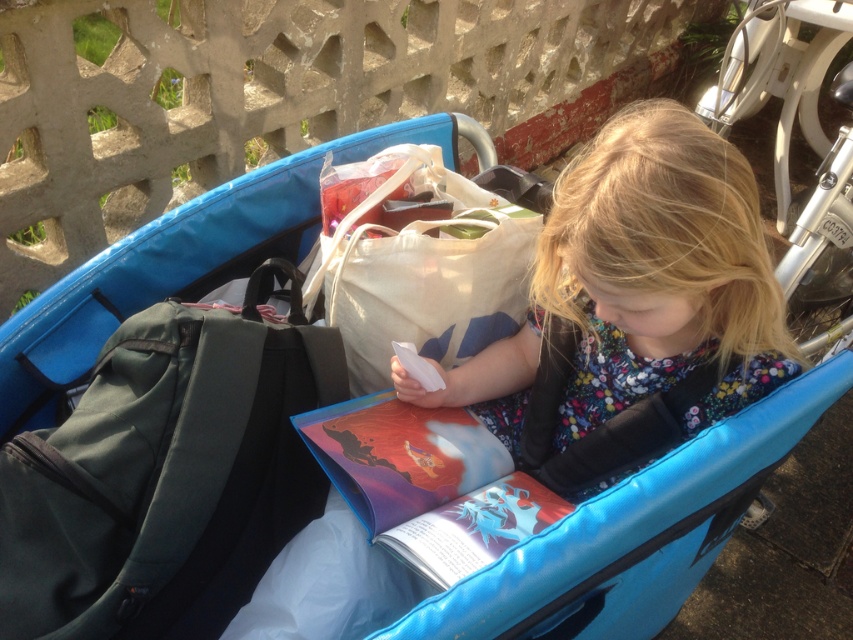
You are helping organize items in the cargo bike basket. You need to place both the dark green fabric backpack at left and the floral fabric dress at center. Since the backpack is smaller, where should you place it to ensure it doesn not get crushed by the dress?

The dark green fabric backpack at left should be placed underneath the floral fabric dress at center because it is smaller and can fit beneath without getting crushed.

You are helping organize the cargo bike basket. The dark green fabric backpack at left and the floral fabric dress at center are both inside. Which item takes up less vertical space in the basket?

The dark green fabric backpack at left has a lesser height compared to the floral fabric dress at center, so it takes up less vertical space in the basket.